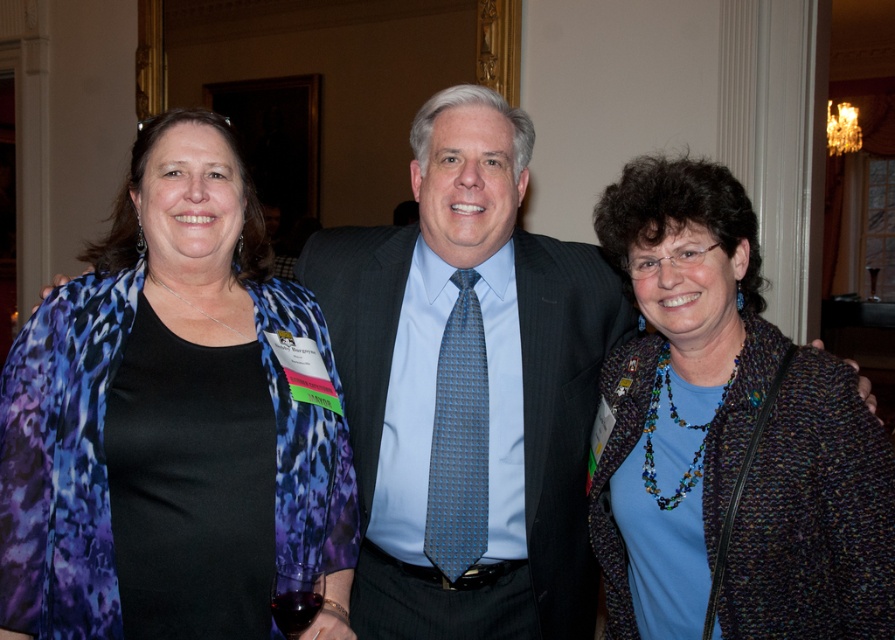
What is the exact coordinate of the matte black shirt at center?

The matte black shirt at center is located at coordinate point (166, 419).

You are a photographer trying to capture a group photo of the multicolored knitted sweater at center and the dark gray pinstripe suit at center. Since you want to ensure both are fully visible in the frame, which person should you position closer to the camera to avoid cropping?

The multicolored knitted sweater at center has a larger width than the dark gray pinstripe suit at center, so positioning the multicolored knitted sweater at center closer to the camera will ensure it fits within the frame without cropping.

What is located at the coordinates point (x=166, y=419)?

The coordinates point (x=166, y=419) contains the matte black shirt at center.